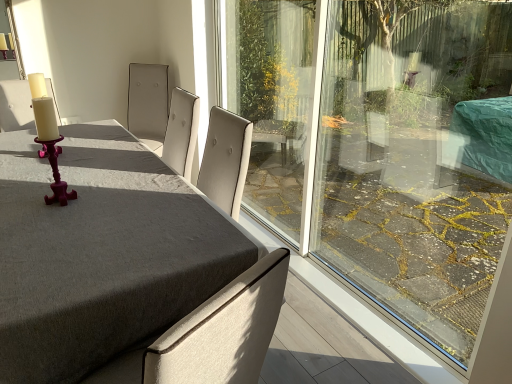
Question: Is matte white chair at left wider than matte gray table at center?

Choices:
 (A) no
 (B) yes

Answer: (A)

Question: From the image's perspective, is matte white chair at left beneath matte gray table at center?

Choices:
 (A) no
 (B) yes

Answer: (A)

Question: From a real-world perspective, is matte white chair at left beneath matte gray table at center?

Choices:
 (A) no
 (B) yes

Answer: (A)

Question: Considering the relative positions of matte white chair at left and matte gray table at center in the image provided, is matte white chair at left to the left of matte gray table at center from the viewer's perspective?

Choices:
 (A) no
 (B) yes

Answer: (B)

Question: From the image's perspective, is matte white chair at left above matte gray table at center?

Choices:
 (A) no
 (B) yes

Answer: (B)

Question: Does matte white chair at left turn towards matte gray table at center?

Choices:
 (A) no
 (B) yes

Answer: (B)

Question: Does matte white chair at left have a larger size compared to matte purple candlestick at left?

Choices:
 (A) yes
 (B) no

Answer: (A)

Question: From a real-world perspective, is matte white chair at left located beneath matte purple candlestick at left?

Choices:
 (A) no
 (B) yes

Answer: (B)

Question: Is matte white chair at left not inside matte purple candlestick at left?

Choices:
 (A) yes
 (B) no

Answer: (A)

Question: Does matte white chair at left touch matte purple candlestick at left?

Choices:
 (A) yes
 (B) no

Answer: (B)

Question: Is matte white chair at left smaller than matte purple candlestick at left?

Choices:
 (A) yes
 (B) no

Answer: (B)

Question: Does matte white chair at left appear on the right side of matte purple candlestick at left?

Choices:
 (A) no
 (B) yes

Answer: (A)

Question: Can you confirm if matte gray table at center is positioned to the right of matte purple candlestick at left?

Choices:
 (A) yes
 (B) no

Answer: (B)